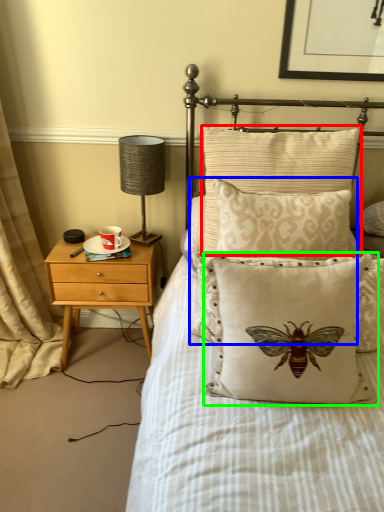
Question: Which object is the farthest from pillow (highlighted by a red box)? Choose among these: pillow (highlighted by a blue box) or pillow (highlighted by a green box).

Choices:
 (A) pillow
 (B) pillow

Answer: (B)